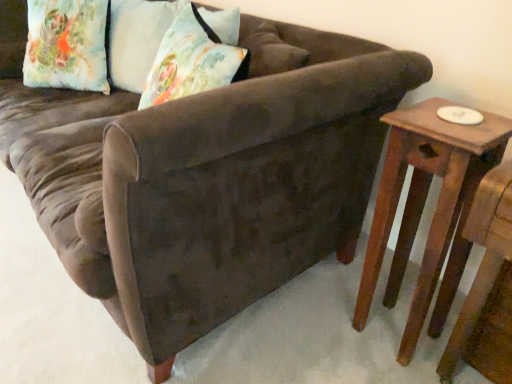
Question: Considering the positions of point (80, 64) and point (474, 127), is point (80, 64) closer or farther from the camera than point (474, 127)?

Choices:
 (A) farther
 (B) closer

Answer: (A)

Question: Based on their positions, is floral fabric pillow at upper left, which appears as the 2th pillow when viewed from the right, located to the left or right of wooden side table at right?

Choices:
 (A) left
 (B) right

Answer: (A)

Question: Estimate the real-world distances between objects in this image. Which object is farther from the floral fabric pillow at upper left, which ranks as the first pillow in left-to-right order?

Choices:
 (A) wooden side table at right
 (B) floral fabric pillow at upper left, which is counted as the 1th pillow, starting from the right

Answer: (A)

Question: Which object is the closest to the floral fabric pillow at upper left, which is counted as the 1th pillow, starting from the right?

Choices:
 (A) floral fabric pillow at upper left, which ranks as the first pillow in left-to-right order
 (B) wooden side table at right

Answer: (A)